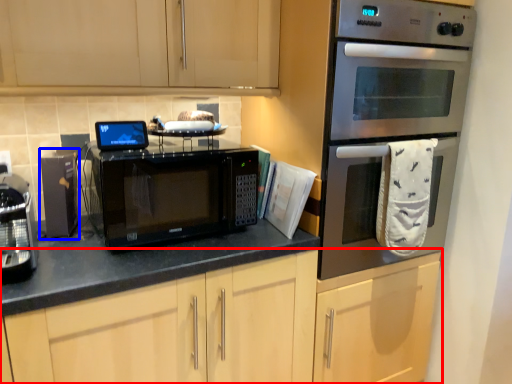
Question: Among these objects, which one is farthest to the camera, cabinetry (highlighted by a red box) or appliance (highlighted by a blue box)?

Choices:
 (A) cabinetry
 (B) appliance

Answer: (B)